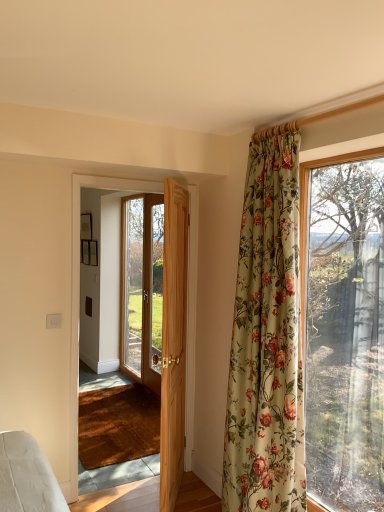
Question: Is wooden door at center, which ranks as the second door in back-to-front order, far from wooden door at center, which is counted as the third door, starting from the front?

Choices:
 (A) no
 (B) yes

Answer: (B)

Question: Does wooden door at center, the second door when ordered from front to back, appear on the left side of wooden door at center, which is counted as the third door, starting from the front?

Choices:
 (A) no
 (B) yes

Answer: (A)

Question: Is wooden door at center, the second door when ordered from front to back, surrounding wooden door at center, marked as the first door in a back-to-front arrangement?

Choices:
 (A) yes
 (B) no

Answer: (B)

Question: Does wooden door at center, the second door when ordered from front to back, have a greater height compared to wooden door at center, marked as the first door in a back-to-front arrangement?

Choices:
 (A) no
 (B) yes

Answer: (A)

Question: Is wooden door at center, which ranks as the second door in back-to-front order, oriented towards wooden door at center, which is counted as the third door, starting from the front?

Choices:
 (A) yes
 (B) no

Answer: (B)

Question: Does wooden door at center, the second door when ordered from front to back, have a greater width compared to wooden door at center, marked as the first door in a back-to-front arrangement?

Choices:
 (A) yes
 (B) no

Answer: (B)

Question: From the image's perspective, is light brown wooden door at center, the 3th door in the back-to-front sequence, on top of wooden door at center, the second door when ordered from front to back?

Choices:
 (A) yes
 (B) no

Answer: (B)

Question: Does light brown wooden door at center, the 3th door in the back-to-front sequence, have a lesser width compared to wooden door at center, the second door when ordered from front to back?

Choices:
 (A) yes
 (B) no

Answer: (B)

Question: From the image's perspective, does light brown wooden door at center, the 3th door in the back-to-front sequence, appear lower than wooden door at center, which ranks as the second door in back-to-front order?

Choices:
 (A) yes
 (B) no

Answer: (A)

Question: From a real-world perspective, is light brown wooden door at center, the 3th door in the back-to-front sequence, positioned over wooden door at center, the second door when ordered from front to back, based on gravity?

Choices:
 (A) no
 (B) yes

Answer: (A)

Question: Does light brown wooden door at center, the 3th door in the back-to-front sequence, lie behind wooden door at center, which ranks as the second door in back-to-front order?

Choices:
 (A) no
 (B) yes

Answer: (A)

Question: Is light brown wooden door at center, the 3th door in the back-to-front sequence, wider than wooden door at center, the second door when ordered from front to back?

Choices:
 (A) no
 (B) yes

Answer: (B)

Question: Would you say light brown wooden door at center, the 1th door viewed from the front, contains wooden door at center, which is counted as the third door, starting from the front?

Choices:
 (A) no
 (B) yes

Answer: (A)